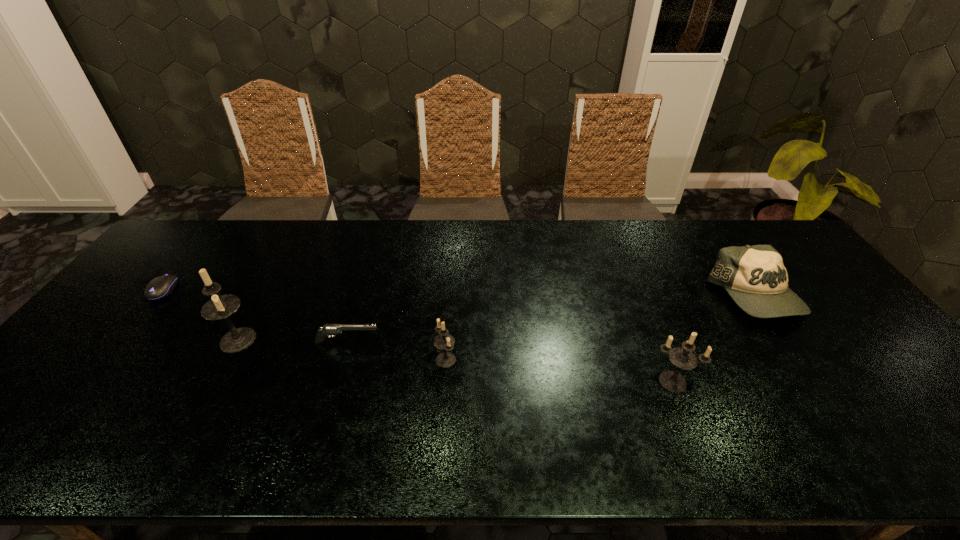
Image resolution: width=960 pixels, height=540 pixels. Identify the location of candle holder that is the closest to the shortest candle holder. (219, 307).

This screenshot has height=540, width=960. I want to click on free space that satisfies the following two spatial constraints: 1. on the back side of the fifth shortest object; 2. on the front-facing side of the third object from left to right, so click(658, 342).

At what (x,y) coordinates should I click in order to perform the action: click on free location that satisfies the following two spatial constraints: 1. on the front-facing side of the baseball cap; 2. on the front-facing side of the fourth object from right to left. Please return your answer as a coordinate pair (x, y). The height and width of the screenshot is (540, 960). Looking at the image, I should click on (785, 342).